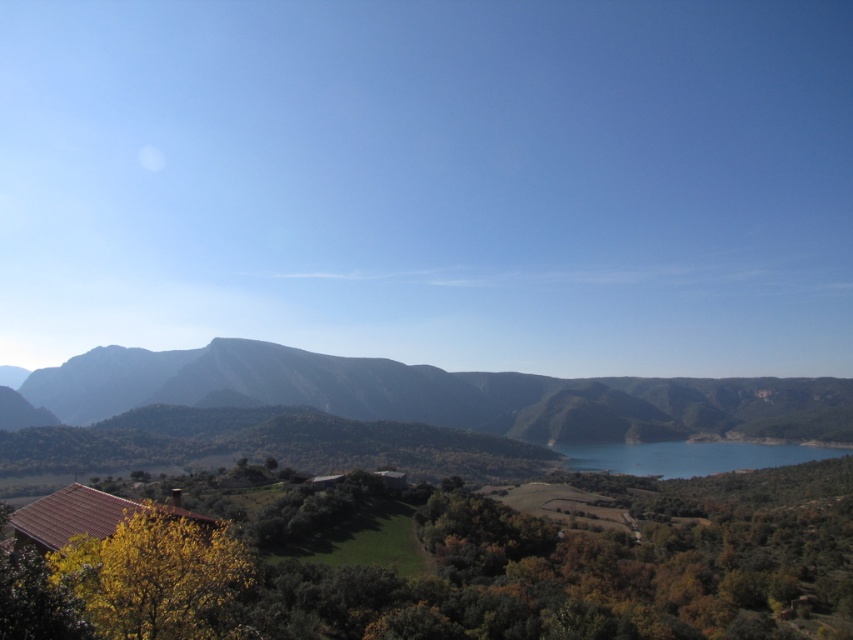
You are standing in the foreground of the image, near the house with the reddish brown tiled roof. You want to take a photo of the rocky gray mountains at center. Which direction should you face to capture them in your view?

The rocky gray mountains at center are located at point (445, 397), which means they are positioned to the right and slightly above the center of the image. Therefore, you should face towards the right side of the scene to capture them in your view.

You are standing at the edge of the blue glassy lake at center and want to reach the rocky gray mountains at center. Which direction should you head towards?

You should head to the left since the rocky gray mountains at center are located to the left of the blue glassy lake at center.

You are standing at the base of the rocky gray mountains at center and want to reach the top. The path you intend to take is 401.76 meters long. If your average walking speed is 3 km per hour, how long will it take you to reach the top?

The path between the rocky gray mountains at center is 401.76 meters long. Converting meters to kilometers, 401.76 meters equals 0.40176 kilometers. At a walking speed of 3 km per hour, dividing the distance by speed gives 0.40176 km divided by 3 km per hour, which equals approximately 0.1339 hours. Converting hours to minutes by multiplying by 60, this results in roughly 8.03 minutes. Therefore, it will take approximately 8 minutes to reach the top.